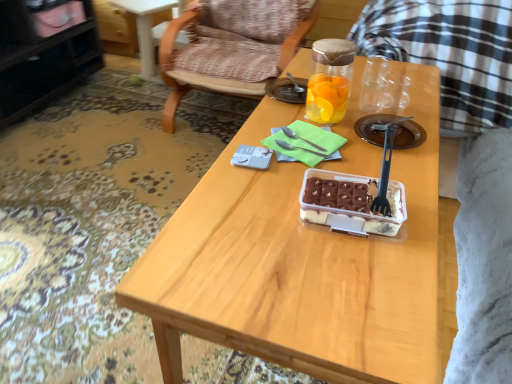
Where is `free location in front of translucent plastic container at center`? free location in front of translucent plastic container at center is located at coordinates (361, 278).